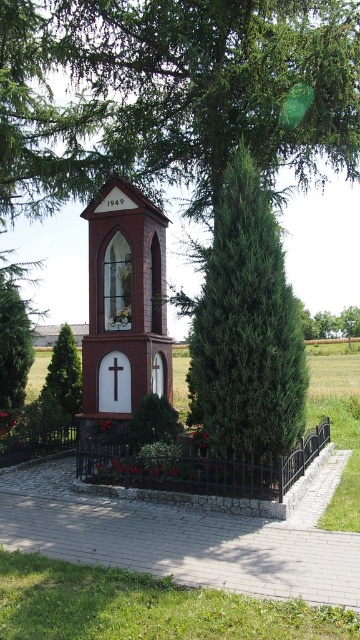
Question: Is black wrought iron fence at center behind green leafy tree at lower left?

Choices:
 (A) no
 (B) yes

Answer: (A)

Question: Considering the relative positions of black wrought iron fence at center and white matte cross at center in the image provided, where is black wrought iron fence at center located with respect to white matte cross at center?

Choices:
 (A) left
 (B) right

Answer: (B)

Question: Which point is closer to the camera taking this photo?

Choices:
 (A) (160, 404)
 (B) (272, 468)
 (C) (70, 378)
 (D) (128, 356)

Answer: (B)

Question: Among these objects, which one is nearest to the camera?

Choices:
 (A) green textured tree at center
 (B) white matte cross at center
 (C) black metal fence at lower left
 (D) brown wooden chapel at center

Answer: (A)

Question: Is brown wooden chapel at center positioned at the back of green textured tree at left?

Choices:
 (A) yes
 (B) no

Answer: (B)

Question: Which point appears farthest from the camera in this image?

Choices:
 (A) click(x=19, y=317)
 (B) click(x=115, y=282)
 (C) click(x=56, y=387)
 (D) click(x=70, y=444)

Answer: (C)